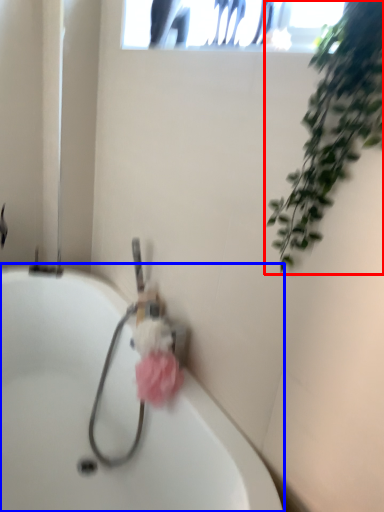
Question: Which object appears closest to the camera in this image, houseplant (highlighted by a red box) or bathtub (highlighted by a blue box)?

Choices:
 (A) houseplant
 (B) bathtub

Answer: (A)